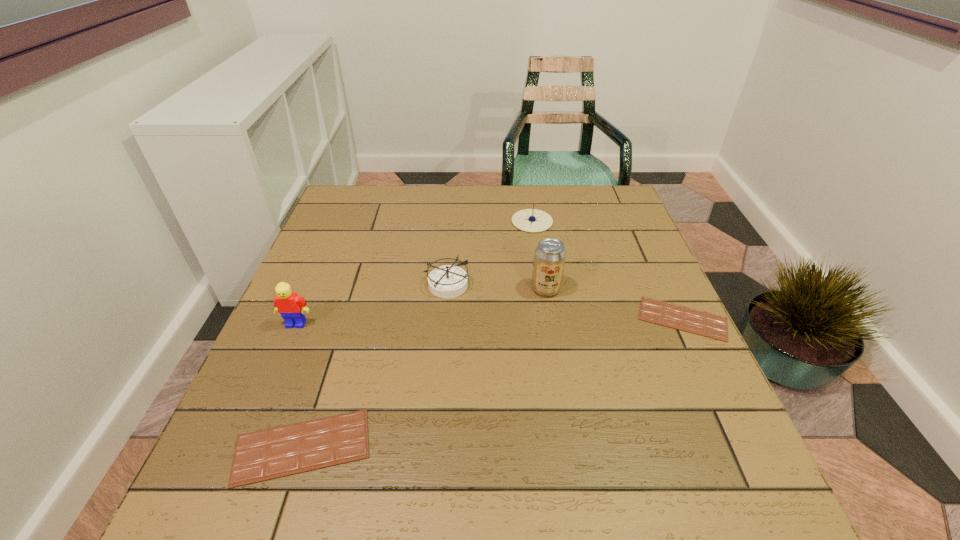
The height and width of the screenshot is (540, 960). Find the location of `object at the right edge`. object at the right edge is located at coordinates 691,320.

The height and width of the screenshot is (540, 960). Find the location of `object located in the near left corner section of the desktop`. object located in the near left corner section of the desktop is located at coordinates (277, 452).

Identify the location of vacant point at the far edge. (483, 208).

At what (x,y) coordinates should I click in order to perform the action: click on blank space at the near edge of the desktop. Please return your answer as a coordinate pair (x, y). Looking at the image, I should click on (528, 410).

This screenshot has width=960, height=540. In order to click on vacant space at the left edge of the desktop in this screenshot , I will do `click(275, 363)`.

This screenshot has width=960, height=540. What are the coordinates of `vacant space at the right edge` in the screenshot? It's located at (605, 268).

Find the location of a particular element. vacant region at the far left corner of the desktop is located at coordinates (375, 190).

Image resolution: width=960 pixels, height=540 pixels. In order to click on free region at the near left corner of the desktop in this screenshot , I will do `click(314, 410)`.

Locate an element on the screen. This screenshot has height=540, width=960. blank space at the far right corner of the desktop is located at coordinates (601, 221).

The width and height of the screenshot is (960, 540). Find the location of `unoccupied position between the left chocolate bar and the shorter chocolate bar`. unoccupied position between the left chocolate bar and the shorter chocolate bar is located at coordinates (492, 383).